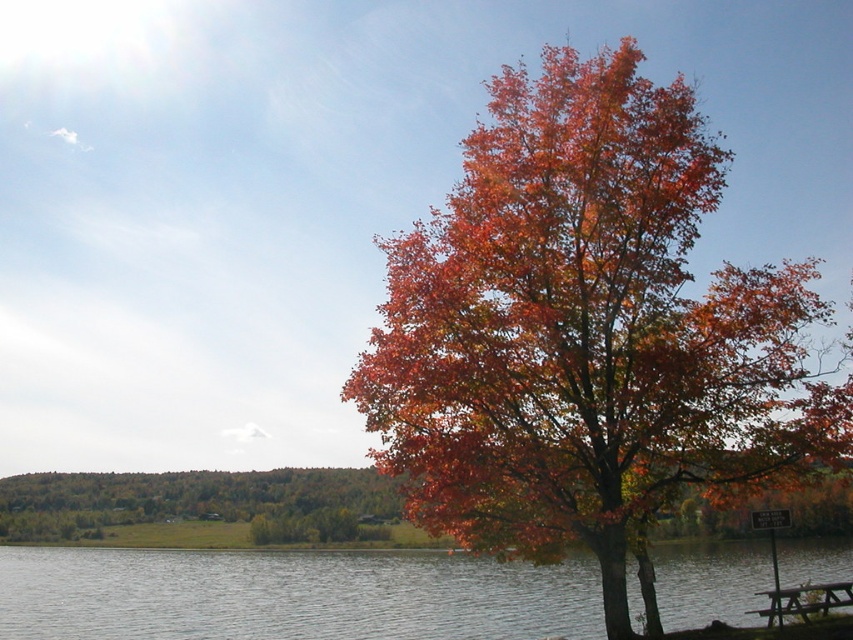
Is clear water at lower center below orange leafy tree at center?

Indeed, clear water at lower center is positioned under orange leafy tree at center.

Does clear water at lower center have a larger size compared to orange leafy tree at center?

Yes.

Is point (271, 566) positioned in front of point (7, 522)?

Yes, it is.

This screenshot has height=640, width=853. Identify the location of clear water at lower center. (289, 595).

In the scene shown: Measure the distance between point (532, 472) and camera.

A distance of 16.48 meters exists between point (532, 472) and camera.

The image size is (853, 640). In order to click on shiny orange leaves at center in this screenshot , I will do `click(585, 332)`.

Find the location of a particular element. shiny orange leaves at center is located at coordinates (585, 332).

What are the coordinates of `shiny orange leaves at center` in the screenshot? It's located at (585, 332).

Is shiny orange leaves at center positioned in front of wooden picnic table at lower right?

Yes.

Is shiny orange leaves at center above wooden picnic table at lower right?

Yes, shiny orange leaves at center is above wooden picnic table at lower right.

Is point (766, 307) positioned behind point (785, 608)?

No, (766, 307) is closer to viewer.

The height and width of the screenshot is (640, 853). I want to click on shiny orange leaves at center, so click(x=585, y=332).